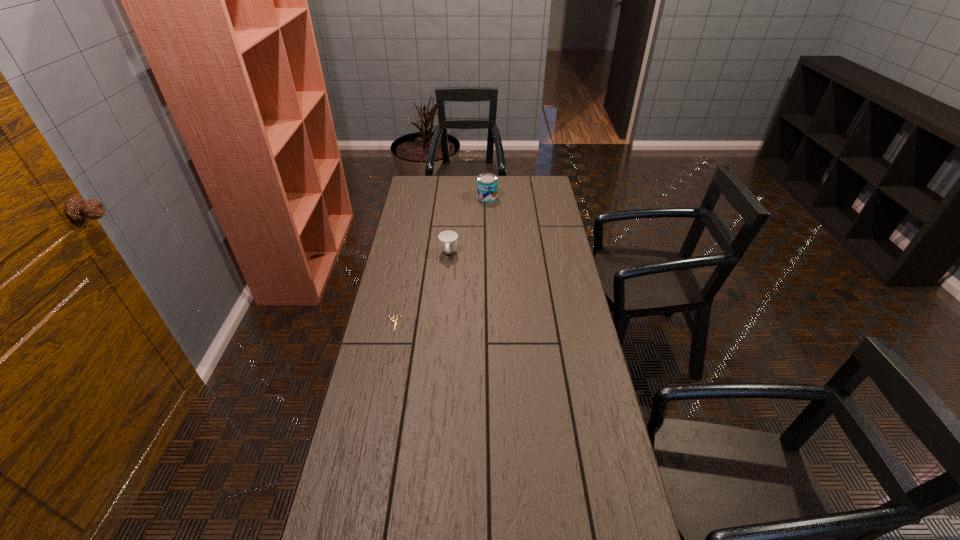
The image size is (960, 540). Find the location of `free space between the rightmost object and the second object from right to left`. free space between the rightmost object and the second object from right to left is located at coordinates (468, 226).

This screenshot has width=960, height=540. I want to click on vacant space that's between the second farthest object and the tallest object, so pyautogui.click(x=468, y=226).

Identify the location of empty space between the nearest object and the second nearest object. (421, 288).

Where is `vacant space in between the shortest object and the second shortest object`? vacant space in between the shortest object and the second shortest object is located at coordinates (421, 288).

Identify which object is the second nearest to the rightmost object. Please provide its 2D coordinates. Your answer should be formatted as a tuple, i.e. [(x, y)], where the tuple contains the x and y coordinates of a point satisfying the conditions above.

[(395, 322)]

Locate an element on the screen. Image resolution: width=960 pixels, height=540 pixels. the closest object relative to the second object from right to left is located at coordinates (395, 322).

Where is `vacant space that satisfies the following two spatial constraints: 1. on the back side of the rightmost object; 2. on the left side of the shears`? The width and height of the screenshot is (960, 540). vacant space that satisfies the following two spatial constraints: 1. on the back side of the rightmost object; 2. on the left side of the shears is located at coordinates (420, 197).